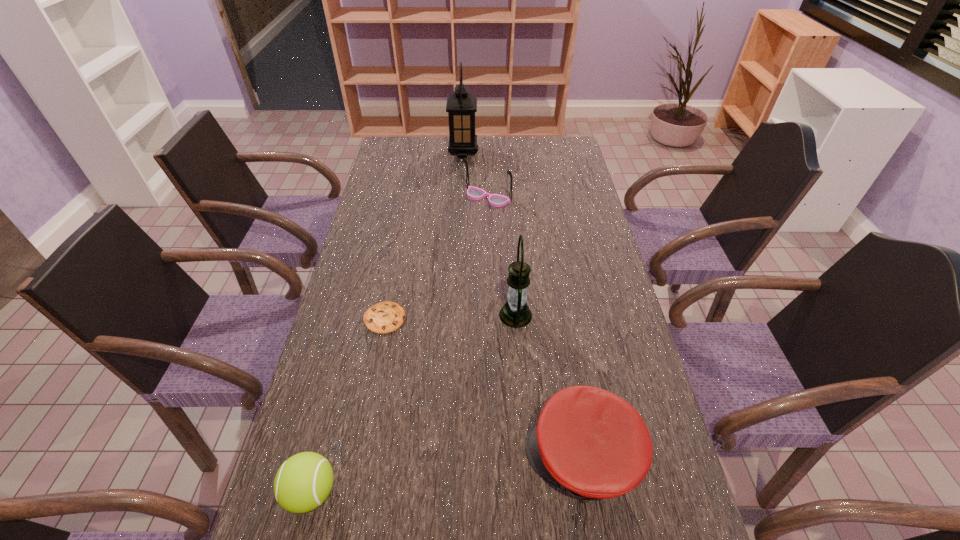
At what (x,y) coordinates should I click in order to perform the action: click on tennis ball present at the left edge. Please return your answer as a coordinate pair (x, y). Looking at the image, I should click on (304, 481).

This screenshot has width=960, height=540. Identify the location of cookie located in the left edge section of the desktop. (384, 317).

The width and height of the screenshot is (960, 540). Identify the location of object that is at the right edge. click(x=593, y=444).

At what (x,y) coordinates should I click in order to perform the action: click on blank space at the left edge. Please return your answer as a coordinate pair (x, y). The height and width of the screenshot is (540, 960). Looking at the image, I should click on click(x=380, y=208).

You are a GUI agent. You are given a task and a screenshot of the screen. Output one action in this format:
    pyautogui.click(x=<x>, y=<y>)
    Task: Click on the vacant area at the right edge
    Image resolution: width=960 pixels, height=540 pixels.
    Given the screenshot: What is the action you would take?
    pyautogui.click(x=585, y=241)

This screenshot has height=540, width=960. I want to click on vacant space at the far right corner of the desktop, so click(x=577, y=151).

Where is `vacant space in between the tennis ball and the cap`? vacant space in between the tennis ball and the cap is located at coordinates [447, 475].

The image size is (960, 540). I want to click on vacant area between the spectacles and the shortest object, so click(436, 258).

You are a GUI agent. You are given a task and a screenshot of the screen. Output one action in this format:
    pyautogui.click(x=<x>, y=<y>)
    Task: Click on the vacant space that's between the third tallest object and the tennis ball
    
    Given the screenshot: What is the action you would take?
    pyautogui.click(x=399, y=345)

I want to click on free space that is in between the cap and the right lantern, so click(x=549, y=387).